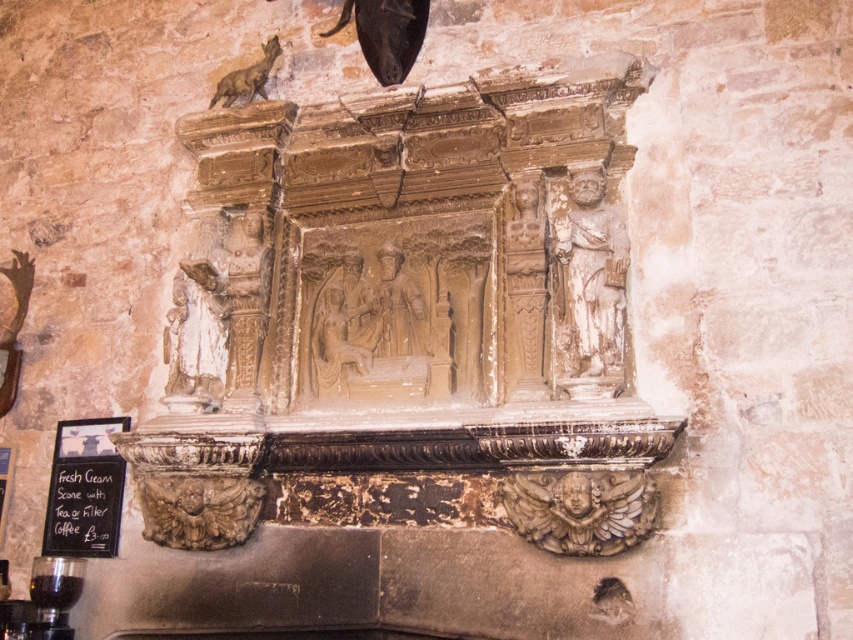
Question: Which object is the farthest from the carved stone figure at right?

Choices:
 (A) bronze wolf at upper left
 (B) beige stone relief at center

Answer: (A)

Question: Which point is farther to the camera?

Choices:
 (A) beige stone relief at center
 (B) bronze wolf at upper left
 (C) carved stone figure at right
 (D) carved stone figure at center

Answer: (B)

Question: Does carved stone figure at right appear on the left side of stone statue at left?

Choices:
 (A) no
 (B) yes

Answer: (A)

Question: Is carved stone figure at right bigger than stone statue at left?

Choices:
 (A) no
 (B) yes

Answer: (B)

Question: Which object appears farthest from the camera in this image?

Choices:
 (A) stone statue at left
 (B) beige stone relief at center
 (C) carved stone figure at center
 (D) carved stone figure at right

Answer: (A)

Question: Can you confirm if carved stone figure at right is positioned to the right of carved stone figure at center?

Choices:
 (A) yes
 (B) no

Answer: (A)